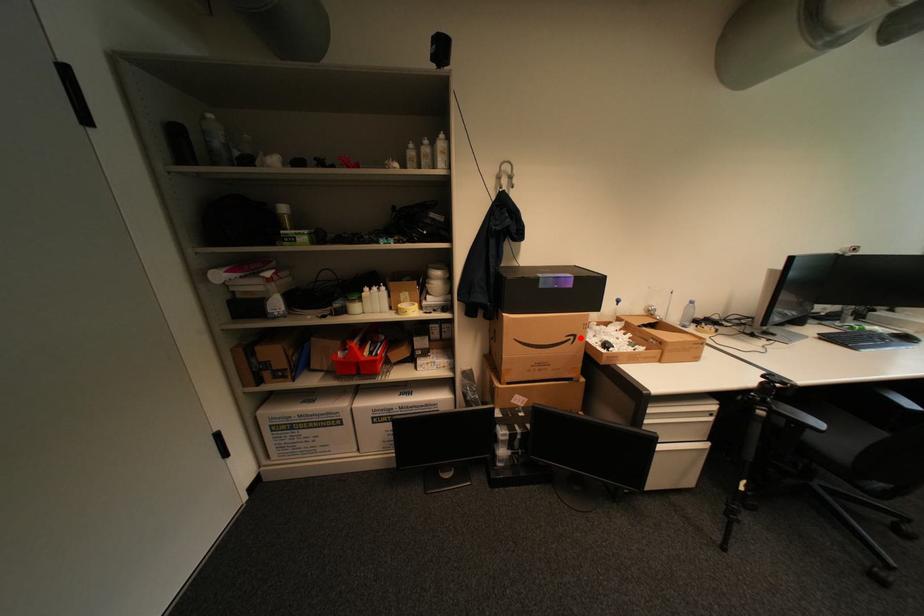
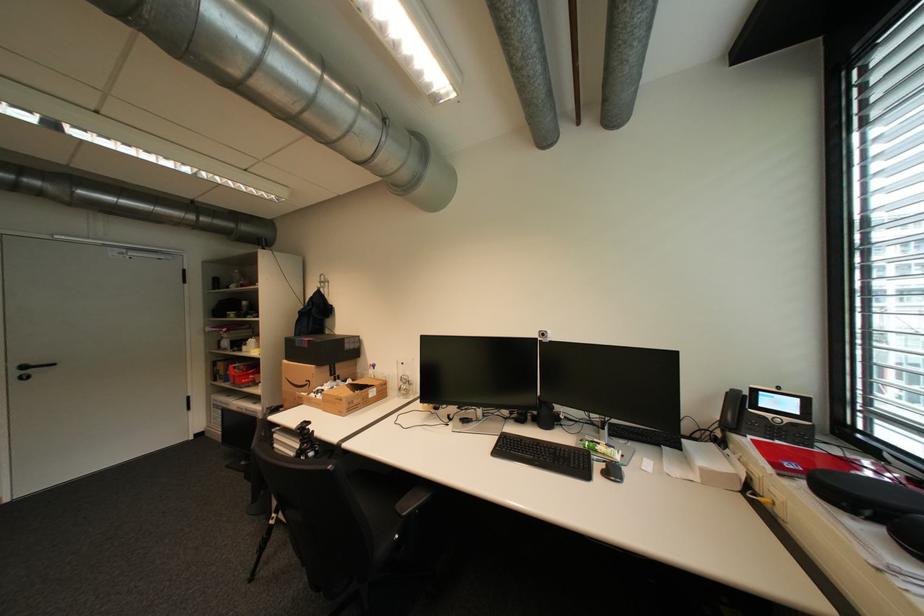
Question: I am providing you with two images of the same scene from different viewpoints. Image1 has a red point marked. In image2, the corresponding 3D location appears at what relative position? Reply with the corresponding letter.

Choices:
 (A) Closer
 (B) Farther

Answer: (B)